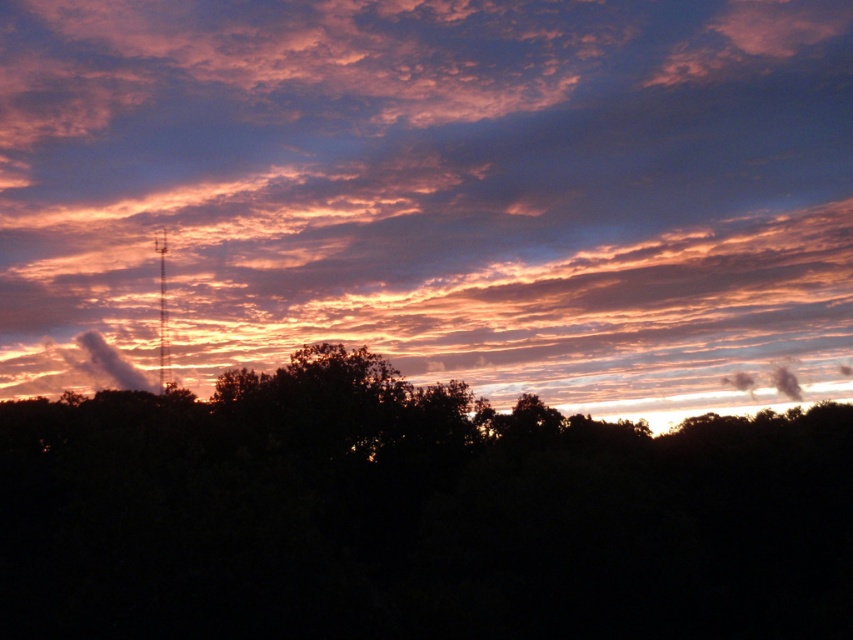
Who is positioned more to the left, cloudy sky at upper center or dark green leafy tree at center?

dark green leafy tree at center is more to the left.

Between cloudy sky at upper center and dark green leafy tree at center, which one appears on the right side from the viewer's perspective?

Positioned to the right is cloudy sky at upper center.

Is point (444, 228) farther from viewer compared to point (109, 508)?

Yes, it is.

At what (x,y) coordinates should I click in order to perform the action: click on cloudy sky at upper center. Please return your answer as a coordinate pair (x, y). Looking at the image, I should click on (431, 189).